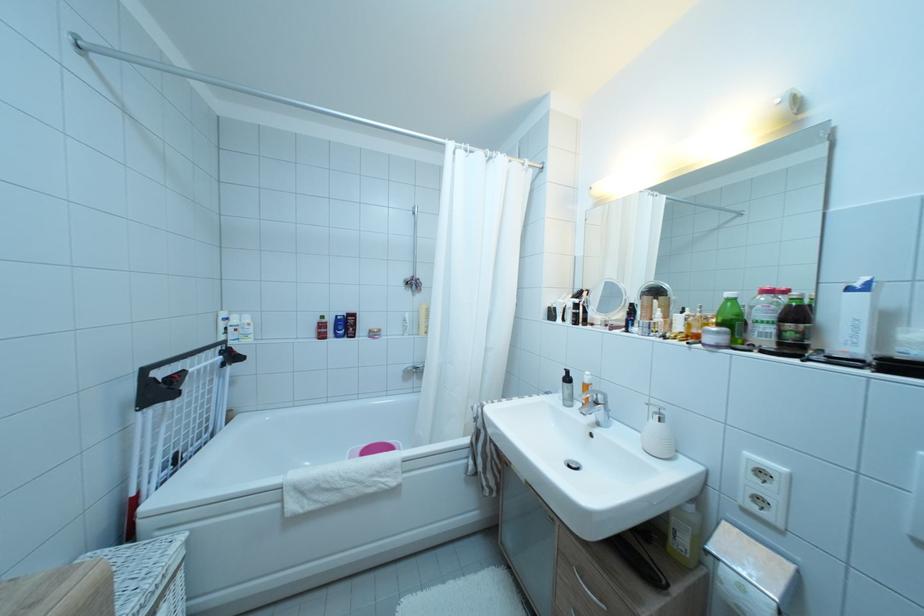
Describe the element at coordinates (794, 323) in the screenshot. The width and height of the screenshot is (924, 616). I see `the brown glass bottle` at that location.